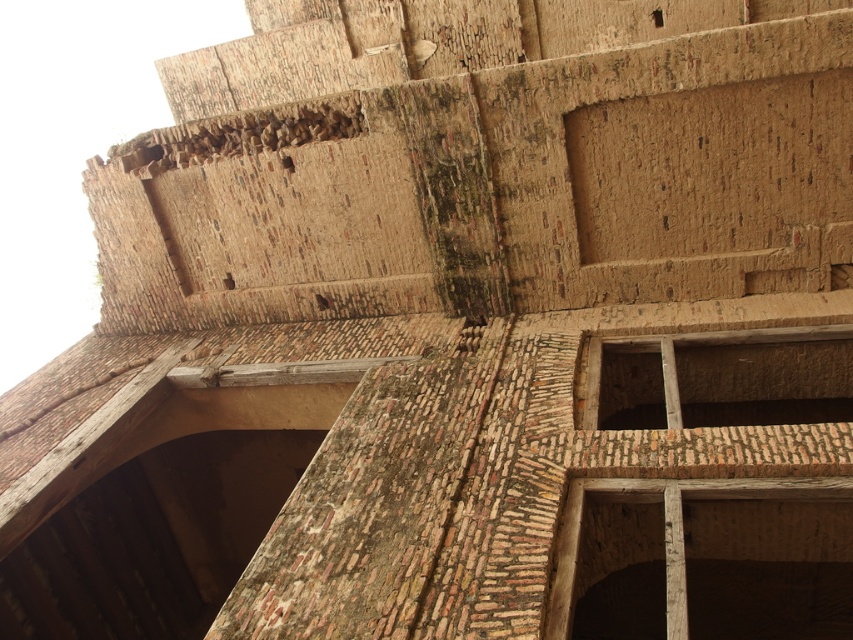
You are an architect examining the old brick structure. You notice the wooden frame at upper center and the brown wooden window at lower right. Which object is located to the right of the other?

The wooden frame at upper center is positioned on the right side of brown wooden window at lower right.